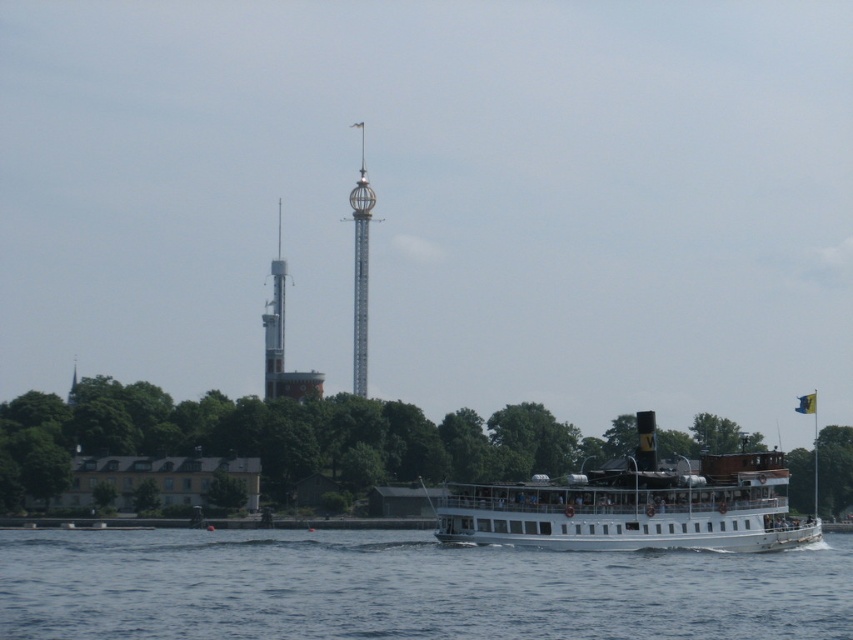
You are standing on the deck of the white steamboat and want to locate the green leafy tree at lower left. According to the coordinates provided, what are its exact 2D coordinates?

The green leafy tree at lower left is located at the 2D coordinates of point (x=288, y=438).

You are standing on the deck of the white steamboat and want to take a photo of the white metallic tower at center. Which direction should you face to ensure the white smooth water at lower center is to the right of the tower in your photo?

You should face towards the left so that the white smooth water at lower center appears to the right of the white metallic tower at center in your photo.

You are on a boat and want to know the position of the white smooth water at lower center and the silver metallic tower at center. Which one is lower in the image?

The white smooth water at lower center is located below the silver metallic tower at center, so it is lower in the image.